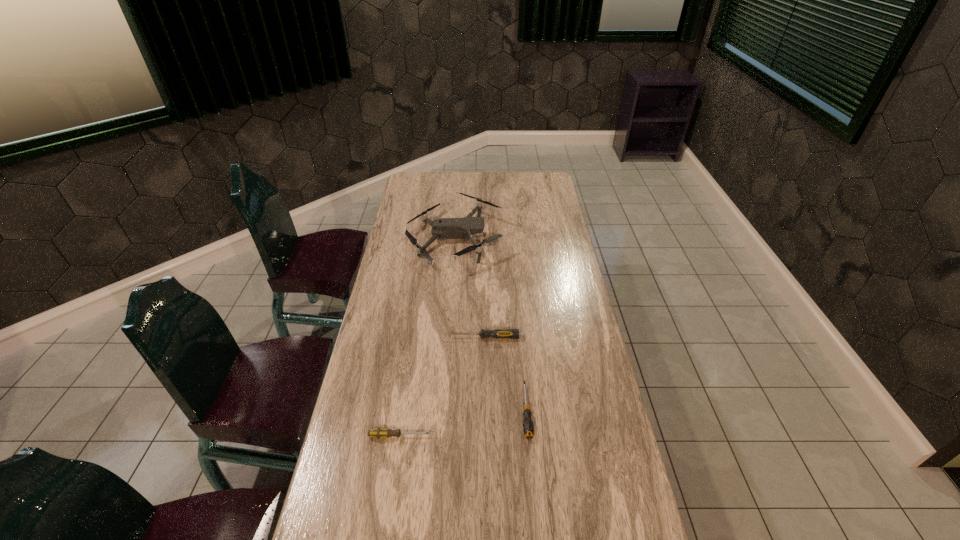
Where is `screwdriver present at the left edge`? The width and height of the screenshot is (960, 540). screwdriver present at the left edge is located at coordinates (378, 433).

Locate an element on the screen. Image resolution: width=960 pixels, height=540 pixels. vacant region at the far edge of the desktop is located at coordinates (468, 180).

Locate an element on the screen. blank space at the left edge of the desktop is located at coordinates click(405, 300).

Locate an element on the screen. This screenshot has width=960, height=540. vacant space at the right edge of the desktop is located at coordinates [x=578, y=478].

Identify the location of vacant space at the far left corner of the desktop. (417, 178).

I want to click on free point between the leftmost screwdriver and the drone, so click(x=427, y=338).

Locate an element on the screen. Image resolution: width=960 pixels, height=540 pixels. free space between the farthest screwdriver and the drone is located at coordinates (469, 288).

Identify the location of vacant area that lies between the leftmost screwdriver and the third nearest object. The image size is (960, 540). (442, 387).

Where is `free space that is in between the tallest object and the second farthest object`? Image resolution: width=960 pixels, height=540 pixels. free space that is in between the tallest object and the second farthest object is located at coordinates (469, 288).

Locate an element on the screen. The image size is (960, 540). the closest object to the drone is located at coordinates (498, 333).